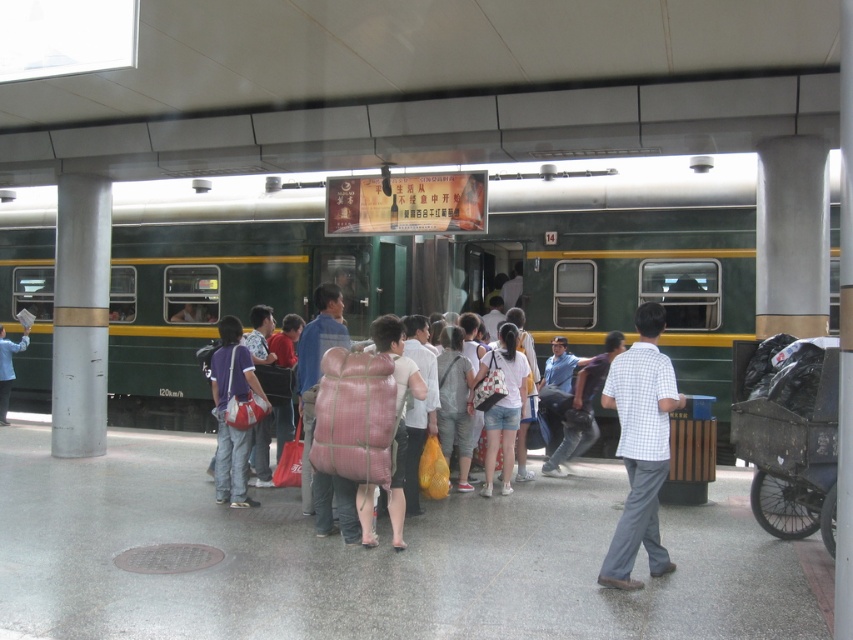
Question: Which point appears closest to the camera in this image?

Choices:
 (A) (235, 227)
 (B) (7, 403)

Answer: (A)

Question: Which object appears closest to the camera in this image?

Choices:
 (A) matte black shirt at center
 (B) green matte train at center

Answer: (B)

Question: Does green matte train at center appear on the right side of matte black shirt at center?

Choices:
 (A) yes
 (B) no

Answer: (A)

Question: Is green matte train at center positioned at the back of matte black shirt at center?

Choices:
 (A) no
 (B) yes

Answer: (A)

Question: Among these points, which one is farthest from the camera?

Choices:
 (A) (418, 282)
 (B) (3, 408)

Answer: (B)

Question: Can you confirm if green matte train at center is positioned to the right of matte black shirt at center?

Choices:
 (A) no
 (B) yes

Answer: (B)